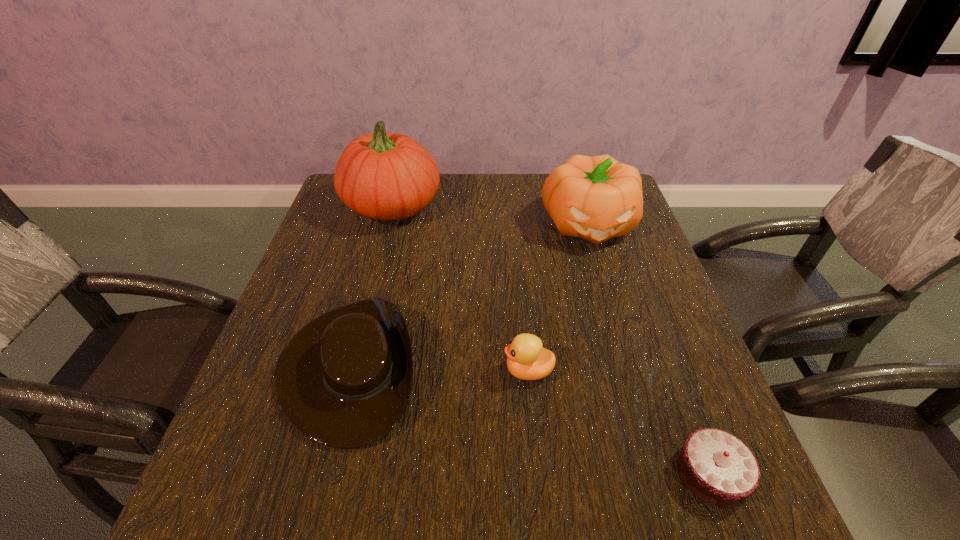
You are a GUI agent. You are given a task and a screenshot of the screen. Output one action in this format:
    pyautogui.click(x=<x>, y=<y>)
    Task: Click on the vacant space located 0.120m on the face of the duckling
    This screenshot has height=540, width=960.
    Given the screenshot: What is the action you would take?
    pyautogui.click(x=443, y=370)

Identify the location of vacant space located on the face of the duckling. (443, 370).

The width and height of the screenshot is (960, 540). I want to click on free space located 0.340m on the face of the duckling, so click(330, 370).

What are the coordinates of `free space located on the right of the cowboy hat` in the screenshot? It's located at (540, 368).

At what (x,y) coordinates should I click in order to perform the action: click on vacant area situated on the back of the chocolate cake. Please return your answer as a coordinate pair (x, y). Looking at the image, I should click on (680, 390).

What are the coordinates of `object at the near edge` in the screenshot? It's located at (716, 466).

Identify the location of pumpkin that is at the left edge. The image size is (960, 540). (384, 176).

Locate an element on the screen. cowboy hat situated at the left edge is located at coordinates (344, 380).

At what (x,y) coordinates should I click in order to perform the action: click on pumpkin that is at the right edge. Please return your answer as a coordinate pair (x, y). The width and height of the screenshot is (960, 540). Looking at the image, I should click on (596, 198).

In order to click on chocolate cake positioned at the right edge in this screenshot , I will do `click(716, 466)`.